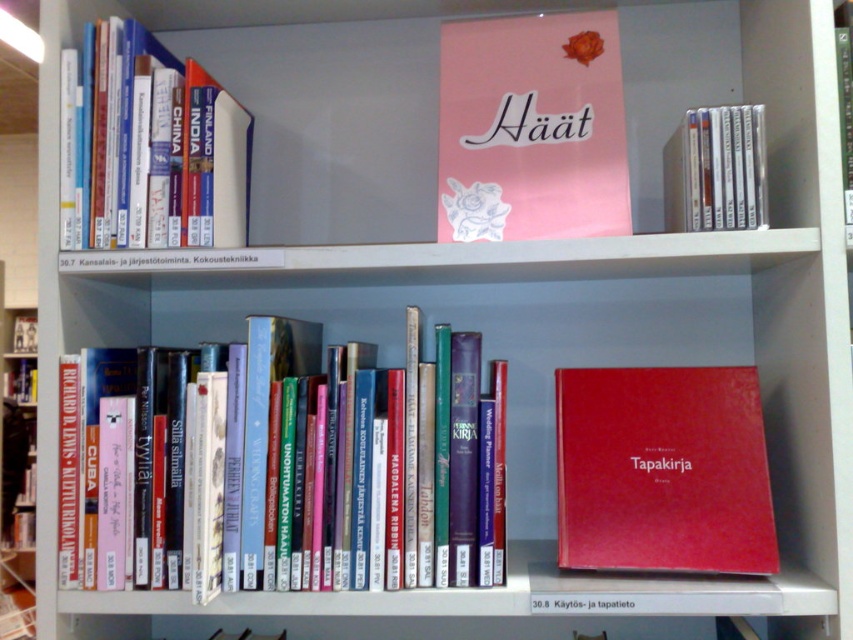
Is hardcover books at center further to the viewer compared to hardcover books at left?

No, it is in front of hardcover books at left.

Does hardcover books at center appear over hardcover books at left?

No, hardcover books at center is not above hardcover books at left.

In the scene shown: Measure the distance between point (209, 355) and camera.

Point (209, 355) and camera are 1.03 meters apart.

Find the location of a particular element. The width and height of the screenshot is (853, 640). hardcover books at center is located at coordinates pyautogui.click(x=276, y=470).

Between point (138, 221) and point (843, 140), which one is positioned behind?

Positioned behind is point (138, 221).

Can you confirm if hardcover books at left is positioned to the right of green matte book at upper center?

In fact, hardcover books at left is to the left of green matte book at upper center.

Is point (96, 124) positioned behind point (845, 74)?

Yes.

Identify the location of hardcover books at left. (152, 148).

Between red matte book at right and matte white cd case at upper right, which one appears on the left side from the viewer's perspective?

From the viewer's perspective, red matte book at right appears more on the left side.

Find the location of `red matte book at right`. red matte book at right is located at coordinates (662, 470).